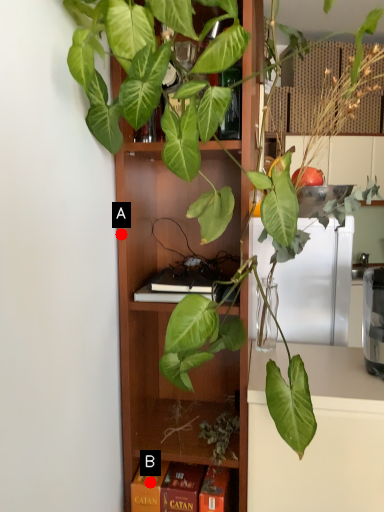
Question: Two points are circled on the image, labeled by A and B beside each circle. Which point is closer to the camera?

Choices:
 (A) A is closer
 (B) B is closer

Answer: (A)